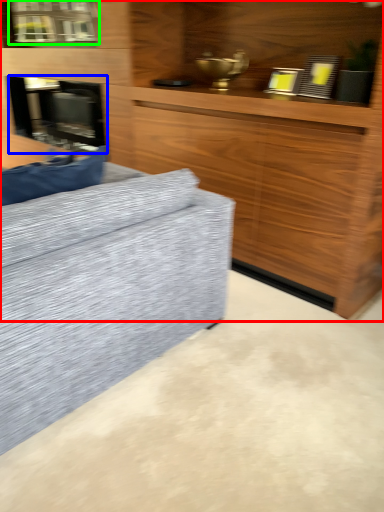
Question: Estimate the real-world distances between objects in this image. Which object is closer to cabinetry (highlighted by a red box), fireplace (highlighted by a blue box) or window (highlighted by a green box)?

Choices:
 (A) fireplace
 (B) window

Answer: (A)